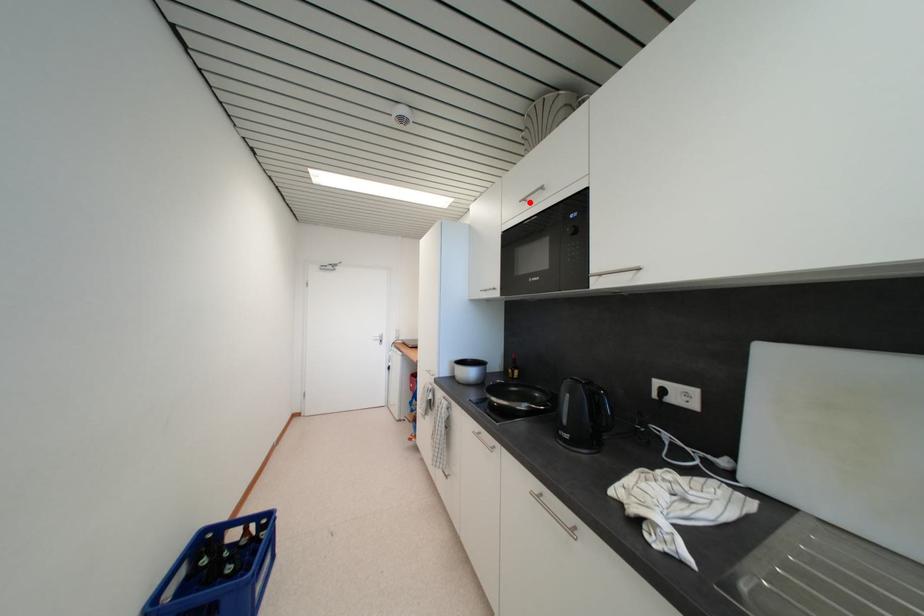
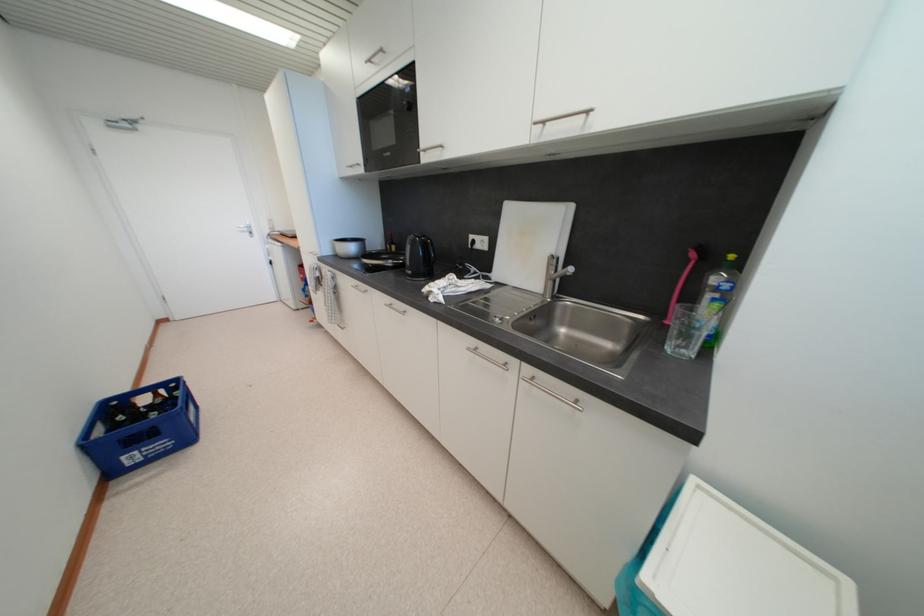
Locate, in the second image, the point that corresponds to the highlighted location in the first image.

(375, 63)